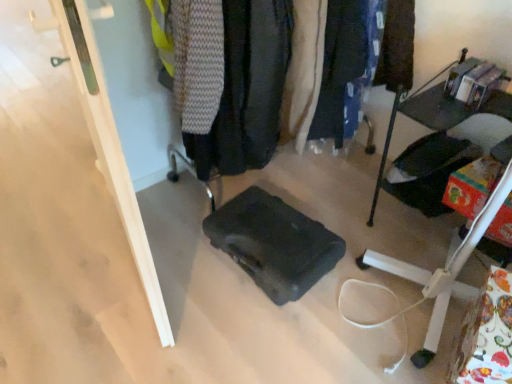
Locate an element on the screen. This screenshot has height=384, width=512. free spot below metallic black shelf at right (from a real-world perspective) is located at coordinates (432, 233).